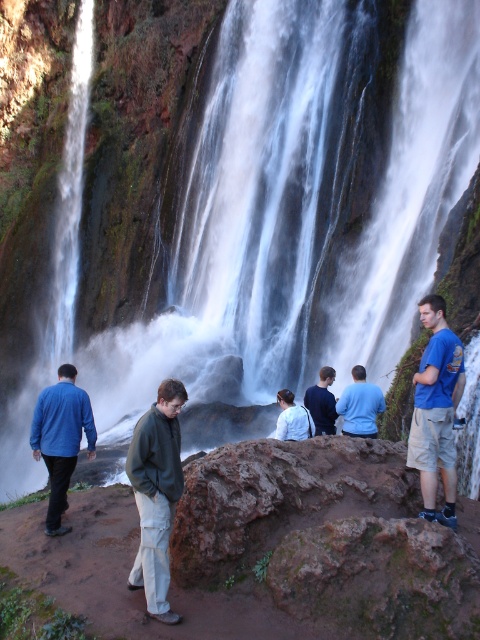
Question: Which point is farther to the camera?

Choices:
 (A) white matte jacket at center
 (B) dark blue shirt at center

Answer: (B)

Question: Observing the image, what is the correct spatial positioning of blue t-shirt at center-right in reference to blue cotton jacket at left?

Choices:
 (A) left
 (B) right

Answer: (B)

Question: Which object is farther from the camera taking this photo?

Choices:
 (A) white matte jacket at center
 (B) blue cotton shirt at center

Answer: (A)

Question: Which point is closer to the camera taking this photo?

Choices:
 (A) (58, 369)
 (B) (283, 422)
 (C) (145, 429)
 (D) (308, 388)

Answer: (C)

Question: Can you confirm if dark blue shirt at center is positioned to the left of white matte jacket at center?

Choices:
 (A) no
 (B) yes

Answer: (A)

Question: Can you confirm if dark green fleece jacket at center is smaller than dark blue shirt at center?

Choices:
 (A) no
 (B) yes

Answer: (B)